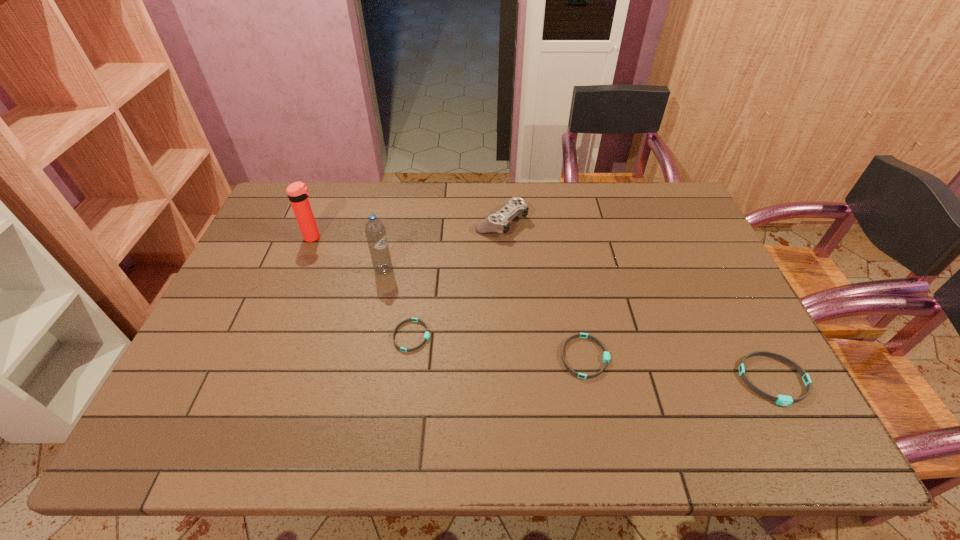
I want to click on blank region between the second object from right to left and the fourth tallest object, so click(680, 368).

I want to click on vacant space in between the shortest object and the third tallest object, so click(457, 279).

The image size is (960, 540). I want to click on vacant space in between the second wristband from left to right and the fourth nearest object, so click(x=485, y=313).

Where is `vacant area between the leftmost wristband and the rightmost object`? vacant area between the leftmost wristband and the rightmost object is located at coordinates (592, 358).

You are a GUI agent. You are given a task and a screenshot of the screen. Output one action in this format:
    pyautogui.click(x=<x>, y=<y>)
    Task: Click on the free space between the second object from right to left and the fourth object from left to right
    The image size is (960, 540).
    Given the screenshot: What is the action you would take?
    pyautogui.click(x=543, y=289)

Find the location of a particular element. The image size is (960, 540). object that stands as the fourth closest to the fifth object from left to right is located at coordinates (375, 231).

Locate which object ranks fourth in proximity to the second tallest wristband. Please provide its 2D coordinates. Your answer should be formatted as a tuple, i.e. [(x, y)], where the tuple contains the x and y coordinates of a point satisfying the conditions above.

[(375, 231)]

Where is `wristband object that ranks as the closest to the third shortest object`? Image resolution: width=960 pixels, height=540 pixels. wristband object that ranks as the closest to the third shortest object is located at coordinates (606, 355).

Select which wristband is the second closest to the third object from right to left. Please provide its 2D coordinates. Your answer should be formatted as a tuple, i.e. [(x, y)], where the tuple contains the x and y coordinates of a point satisfying the conditions above.

[(606, 355)]